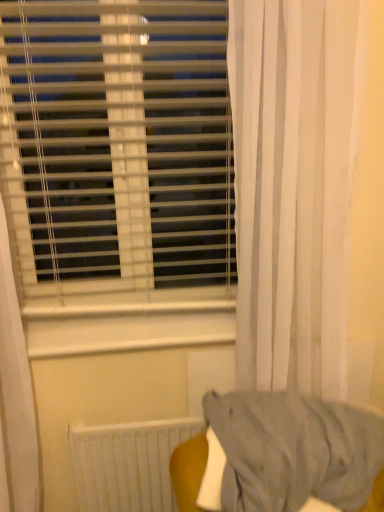
Question: Does white sheer curtain at right have a greater height compared to white plastic blinds at upper left?

Choices:
 (A) no
 (B) yes

Answer: (B)

Question: Is white sheer curtain at right to the left of white plastic blinds at upper left from the viewer's perspective?

Choices:
 (A) no
 (B) yes

Answer: (A)

Question: From the image's perspective, would you say white sheer curtain at right is shown under white plastic blinds at upper left?

Choices:
 (A) yes
 (B) no

Answer: (A)

Question: Is white sheer curtain at right to the right of white plastic blinds at upper left from the viewer's perspective?

Choices:
 (A) yes
 (B) no

Answer: (A)

Question: Considering the relative positions of white sheer curtain at right and white plastic blinds at upper left in the image provided, is white sheer curtain at right in front of white plastic blinds at upper left?

Choices:
 (A) no
 (B) yes

Answer: (B)

Question: From the image's perspective, relative to white matte radiator at lower center, is white sheer curtain at right above or below?

Choices:
 (A) below
 (B) above

Answer: (B)

Question: Looking at their shapes, would you say white sheer curtain at right is wider or thinner than white matte radiator at lower center?

Choices:
 (A) wide
 (B) thin

Answer: (A)

Question: Which is correct: white sheer curtain at right is inside white matte radiator at lower center, or outside of it?

Choices:
 (A) inside
 (B) outside

Answer: (B)

Question: Considering the positions of point (322, 215) and point (132, 476), is point (322, 215) closer or farther from the camera than point (132, 476)?

Choices:
 (A) closer
 (B) farther

Answer: (A)

Question: Is point (266, 155) positioned closer to the camera than point (97, 90)?

Choices:
 (A) farther
 (B) closer

Answer: (B)

Question: In terms of width, does white sheer curtain at right look wider or thinner when compared to white plastic blinds at upper left?

Choices:
 (A) thin
 (B) wide

Answer: (B)

Question: From a real-world perspective, is white sheer curtain at right physically located above or below white plastic blinds at upper left?

Choices:
 (A) above
 (B) below

Answer: (B)

Question: Is white sheer curtain at right taller or shorter than white plastic blinds at upper left?

Choices:
 (A) tall
 (B) short

Answer: (A)

Question: Is white plastic blinds at upper left in front of or behind white matte radiator at lower center in the image?

Choices:
 (A) behind
 (B) front

Answer: (B)

Question: Is white plastic blinds at upper left taller or shorter than white matte radiator at lower center?

Choices:
 (A) short
 (B) tall

Answer: (B)